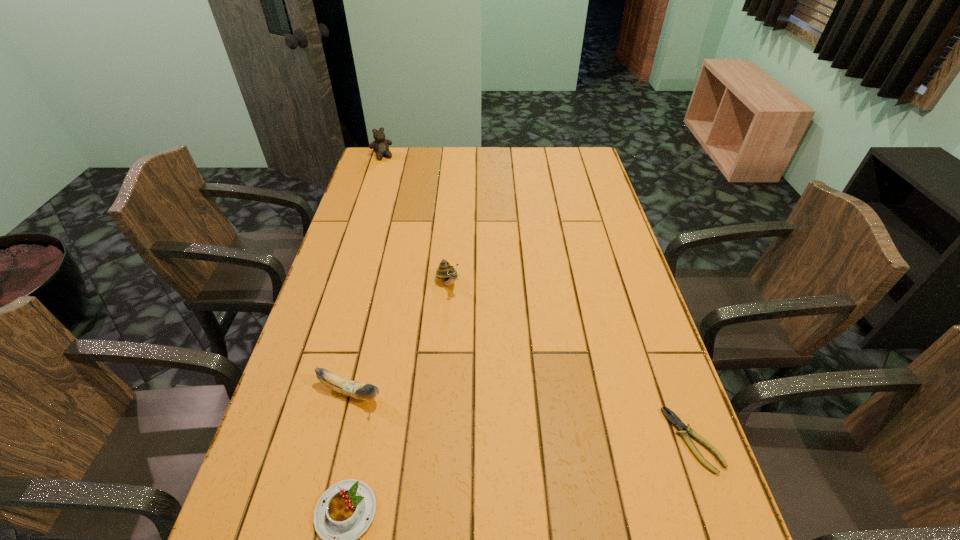
Locate an element on the screen. object that is at the right edge is located at coordinates pos(676,421).

This screenshot has width=960, height=540. I want to click on object positioned at the far left corner, so click(x=380, y=145).

The height and width of the screenshot is (540, 960). Identify the location of object at the near right corner. (676, 421).

The height and width of the screenshot is (540, 960). Identify the location of vacant space at the far edge. (535, 163).

Locate an element on the screen. The height and width of the screenshot is (540, 960). vacant space at the left edge of the desktop is located at coordinates (344, 354).

In the image, there is a desktop. Where is `vacant area at the right edge`? The height and width of the screenshot is (540, 960). vacant area at the right edge is located at coordinates (618, 366).

The image size is (960, 540). In order to click on free space at the far left corner of the desktop in this screenshot , I will do pos(396,170).

At what (x,y) coordinates should I click in order to perform the action: click on free space at the near right corner of the desktop. Please return your answer as a coordinate pair (x, y). The width and height of the screenshot is (960, 540). Looking at the image, I should click on (637, 504).

Where is `empty space between the fourth nearest object and the third tallest object`? empty space between the fourth nearest object and the third tallest object is located at coordinates (399, 339).

The height and width of the screenshot is (540, 960). I want to click on free area in between the fourth nearest object and the pliers, so click(x=570, y=362).